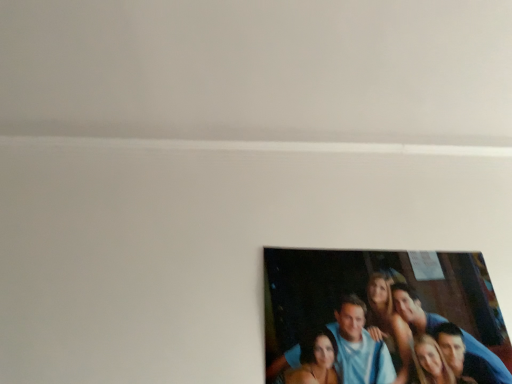
The width and height of the screenshot is (512, 384). What do you see at coordinates (376, 312) in the screenshot?
I see `matte plastic photo frame at lower right` at bounding box center [376, 312].

Measure the distance between point (417, 317) and camera.

Point (417, 317) is 1.07 meters from camera.

The height and width of the screenshot is (384, 512). Find the location of `matte plastic photo frame at lower right`. matte plastic photo frame at lower right is located at coordinates (376, 312).

Locate an element on the screen. matte plastic photo frame at lower right is located at coordinates coord(376,312).